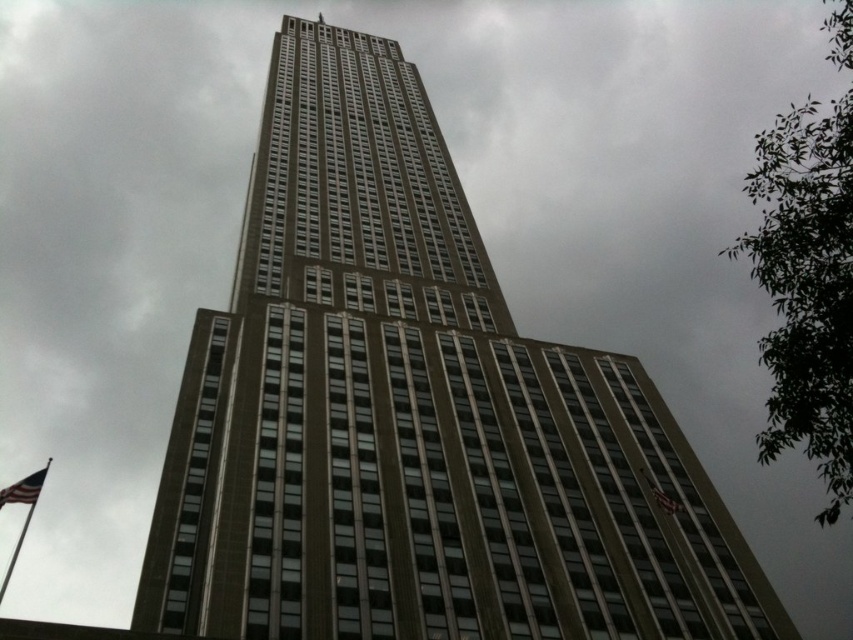
You are standing at the base of the skyscraper looking up. You notice the metallic flag pole at lower left and the american flag at lower left. Which object is closer to the ground?

The metallic flag pole at lower left is closer to the ground because it is positioned below the american flag at lower left.

You are standing at the entrance of the skyscraper and notice the metallic flag pole at lower left. If you walk straight towards the building, will the flag pole become more visible or less visible in your view?

The metallic flag pole at lower left is located at point [27,509], which is near the edge of the scene. As you walk straight towards the building, the flag pole might become less visible because it is positioned off to the side and could be obscured by the building or move out of your direct line of sight.